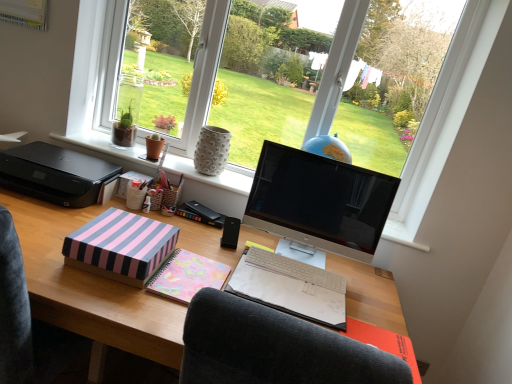
The image size is (512, 384). What are the coordinates of `free region on the left part of pink striped cardboard box at center-left` in the screenshot? It's located at (53, 234).